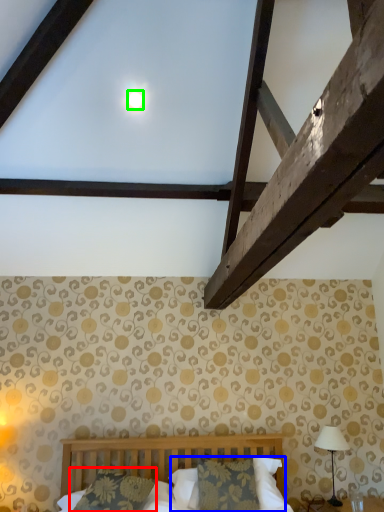
Question: Estimate the real-world distances between objects in this image. Which object is farther from pillow (highlighted by a red box), pillow (highlighted by a blue box) or moonlight (highlighted by a green box)?

Choices:
 (A) pillow
 (B) moonlight

Answer: (B)